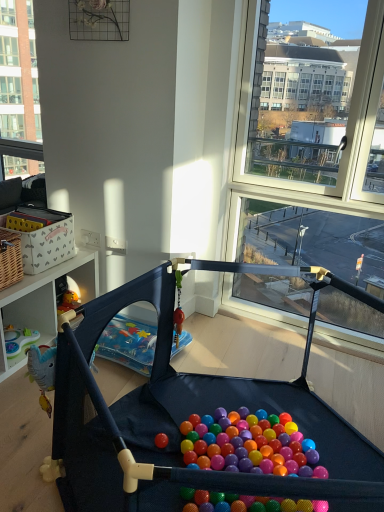
What is the approximate height of clear glass window at upper left?

clear glass window at upper left is 1.37 meters tall.

This screenshot has width=384, height=512. What are the coordinates of `clear glass window at upper left` in the screenshot? It's located at (18, 73).

This screenshot has height=512, width=384. Describe the element at coordinates (18, 73) in the screenshot. I see `clear glass window at upper left` at that location.

In the scene shown: Measure the distance between point [60,364] and camera.

Point [60,364] is 4.60 feet from camera.

What is the approximate height of matte black playpen at center?

matte black playpen at center is 27.83 inches in height.

What do you see at coordinates (185, 416) in the screenshot? I see `matte black playpen at center` at bounding box center [185, 416].

Find the location of a particular element. matte black playpen at center is located at coordinates (185, 416).

Where is `clear glass window at upper left`? Image resolution: width=384 pixels, height=512 pixels. clear glass window at upper left is located at coordinates (18, 73).

Which is more to the right, matte black playpen at center or clear glass window at upper left?

From the viewer's perspective, matte black playpen at center appears more on the right side.

Is matte black playpen at center closer to camera compared to clear glass window at upper left?

Yes, matte black playpen at center is in front of clear glass window at upper left.

Does point (147, 421) come closer to viewer compared to point (18, 164)?

Yes, it is.

From the image's perspective, which one is positioned higher, matte black playpen at center or clear glass window at upper left?

From the image's view, clear glass window at upper left is above.

From a real-world perspective, is matte black playpen at center above or below clear glass window at upper left?

Clearly, from a real-world perspective, matte black playpen at center is below clear glass window at upper left.

Can you confirm if matte black playpen at center is thinner than clear glass window at upper left?

No.

Between matte black playpen at center and clear glass window at upper left, which one has less height?

matte black playpen at center.

Based on the photo, considering the relative sizes of matte black playpen at center and clear glass window at upper left in the image provided, is matte black playpen at center bigger than clear glass window at upper left?

Indeed, matte black playpen at center has a larger size compared to clear glass window at upper left.

Can we say matte black playpen at center lies outside clear glass window at upper left?

Yes.

Are matte black playpen at center and clear glass window at upper left making contact?

No, matte black playpen at center is not with clear glass window at upper left.

Is matte black playpen at center oriented towards clear glass window at upper left?

No, matte black playpen at center is not aimed at clear glass window at upper left.

What's the angular difference between matte black playpen at center and clear glass window at upper left's facing directions?

matte black playpen at center and clear glass window at upper left are facing 8.46 degrees away from each other.

The image size is (384, 512). Identify the location of window that is behind the matte black playpen at center. (18, 73).

Can you confirm if clear glass window at upper left is positioned to the right of matte black playpen at center?

In fact, clear glass window at upper left is to the left of matte black playpen at center.

Which object is further away from the camera, clear glass window at upper left or matte black playpen at center?

clear glass window at upper left is more distant.

Which point is more forward, [28,119] or [75,340]?

Positioned in front is point [75,340].

From the image's perspective, is clear glass window at upper left above matte black playpen at center?

Indeed, from the image's perspective, clear glass window at upper left is shown above matte black playpen at center.

From a real-world perspective, is clear glass window at upper left below matte black playpen at center?

No, from a real-world perspective, clear glass window at upper left is not under matte black playpen at center.

Which of these two, clear glass window at upper left or matte black playpen at center, is thinner?

With smaller width is clear glass window at upper left.

Considering the sizes of clear glass window at upper left and matte black playpen at center in the image, is clear glass window at upper left taller or shorter than matte black playpen at center?

In the image, clear glass window at upper left appears to be taller than matte black playpen at center.

Considering the sizes of clear glass window at upper left and matte black playpen at center in the image, is clear glass window at upper left bigger or smaller than matte black playpen at center?

Considering their sizes, clear glass window at upper left takes up less space than matte black playpen at center.

Would you say clear glass window at upper left is inside or outside matte black playpen at center?

clear glass window at upper left exists outside the volume of matte black playpen at center.

In the scene shown: Would you say clear glass window at upper left is a long distance from matte black playpen at center?

That's right, there is a large distance between clear glass window at upper left and matte black playpen at center.

Does clear glass window at upper left turn towards matte black playpen at center?

No, clear glass window at upper left is not facing towards matte black playpen at center.

What's the angular difference between clear glass window at upper left and matte black playpen at center's facing directions?

8.46 degrees separate the facing orientations of clear glass window at upper left and matte black playpen at center.

This screenshot has width=384, height=512. Find the location of `window behind the matte black playpen at center`. window behind the matte black playpen at center is located at coordinates (18, 73).

Find the location of a particular element. baby carriage that is in front of the clear glass window at upper left is located at coordinates (185, 416).

At what (x,y) coordinates should I click in order to perform the action: click on window that is above the matte black playpen at center (from a real-world perspective). Please return your answer as a coordinate pair (x, y). This screenshot has width=384, height=512. Looking at the image, I should click on (18, 73).